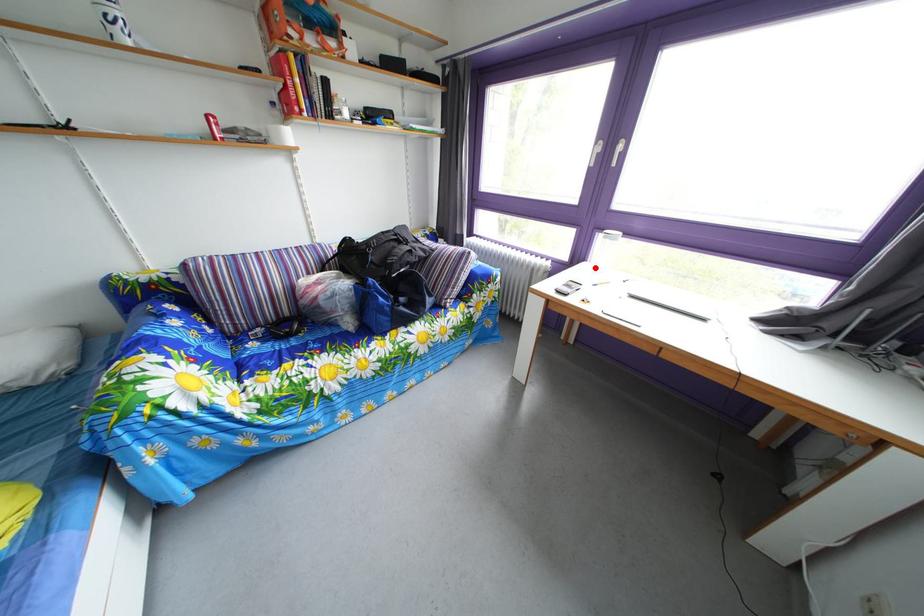
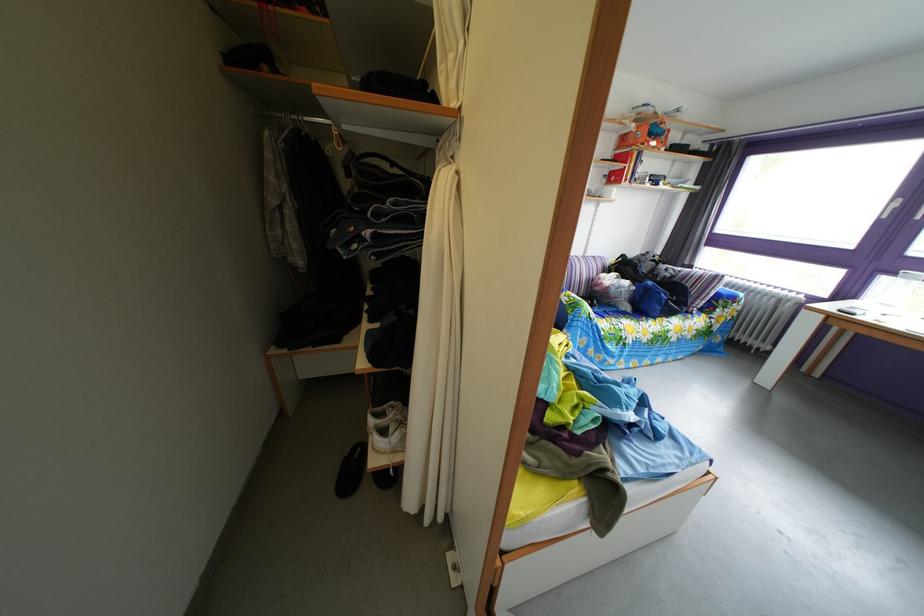
Question: I am providing you with two images of the same scene from different viewpoints. A red point is marked on the first image. Can you still see the location of the red point in image 2?

Choices:
 (A) Yes
 (B) No

Answer: (B)